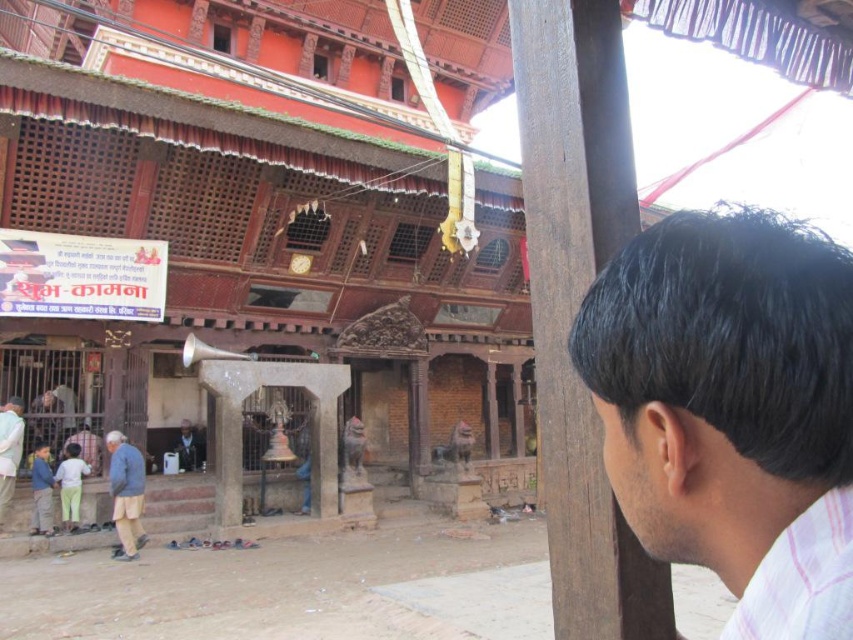
Question: Considering the relative positions of dark brown hair at upper right and light blue fabric at lower left in the image provided, where is dark brown hair at upper right located with respect to light blue fabric at lower left?

Choices:
 (A) left
 (B) right

Answer: (B)

Question: Which object is positioned farthest from the blue cotton shirt at lower left?

Choices:
 (A) dark blue shirt at center
 (B) blue denim jacket at lower left
 (C) brown wooden pillar at center

Answer: (C)

Question: Where is light blue fabric at lower left located in relation to blue cotton shirt at lower left in the image?

Choices:
 (A) left
 (B) right

Answer: (A)

Question: Which object is farther from the camera taking this photo?

Choices:
 (A) brown wooden pillar at center
 (B) light green cotton pants at lower left
 (C) dark brown hair at upper right

Answer: (B)

Question: Estimate the real-world distances between objects in this image. Which object is closer to the light green cotton pants at lower left?

Choices:
 (A) brown wooden pillar at center
 (B) blue cotton shirt at lower left
 (C) dark brown hair at upper right
 (D) dark blue shirt at center

Answer: (B)

Question: Can you confirm if light blue fabric at lower left is positioned to the left of light green cotton pants at lower left?

Choices:
 (A) yes
 (B) no

Answer: (A)